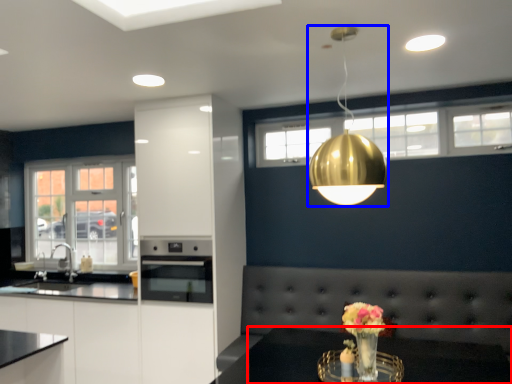
Question: Among these objects, which one is farthest to the camera, table (highlighted by a red box) or lamp (highlighted by a blue box)?

Choices:
 (A) table
 (B) lamp

Answer: (B)